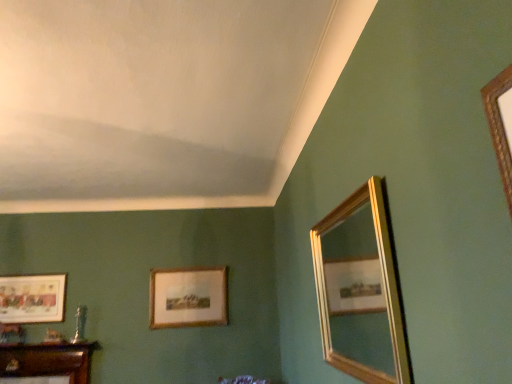
In order to face gold-framed picture at center, acting as the first picture frame starting from the right, should I rotate leftwards or rightwards?

Turn left by 8.998 degrees to look at gold-framed picture at center, acting as the first picture frame starting from the right.

This screenshot has height=384, width=512. What do you see at coordinates (188, 297) in the screenshot?
I see `gold-framed picture at center, which appears as the second picture frame when viewed from the left` at bounding box center [188, 297].

The width and height of the screenshot is (512, 384). Describe the element at coordinates (361, 289) in the screenshot. I see `gold-framed mirror at right` at that location.

Where is `gold-framed picture at center, acting as the first picture frame starting from the right`? gold-framed picture at center, acting as the first picture frame starting from the right is located at coordinates (188, 297).

Is gold-framed mirror at right completely or partially inside gold-framed picture at center, which appears as the second picture frame when viewed from the left?

No, gold-framed mirror at right is located outside of gold-framed picture at center, which appears as the second picture frame when viewed from the left.

Could you tell me if gold-framed picture at center, acting as the first picture frame starting from the right, is facing gold-framed mirror at right?

Yes, gold-framed picture at center, acting as the first picture frame starting from the right, is oriented towards gold-framed mirror at right.

Is gold-framed picture at center, acting as the first picture frame starting from the right, in front of or behind gold-framed mirror at right in the image?

gold-framed picture at center, acting as the first picture frame starting from the right, is positioned farther from the viewer than gold-framed mirror at right.

Does gold-framed picture at center, which appears as the second picture frame when viewed from the left, have a lesser width compared to gold-framed mirror at right?

Correct, the width of gold-framed picture at center, which appears as the second picture frame when viewed from the left, is less than that of gold-framed mirror at right.

In the image, is matte gold picture frame at lower left, arranged as the second picture frame when viewed from the right, positioned in front of or behind gold-framed mirror at right?

matte gold picture frame at lower left, arranged as the second picture frame when viewed from the right, is behind gold-framed mirror at right.

From the image's perspective, which one is positioned lower, matte gold picture frame at lower left, arranged as the first picture frame when viewed from the left, or gold-framed mirror at right?

matte gold picture frame at lower left, arranged as the first picture frame when viewed from the left, is shown below in the image.

Is matte gold picture frame at lower left, arranged as the first picture frame when viewed from the left, placed right next to gold-framed mirror at right?

No, matte gold picture frame at lower left, arranged as the first picture frame when viewed from the left, is not beside gold-framed mirror at right.

From a real-world perspective, is gold-framed mirror at right positioned over matte gold picture frame at lower left, arranged as the second picture frame when viewed from the right, based on gravity?

No, from a real-world perspective, gold-framed mirror at right is not above matte gold picture frame at lower left, arranged as the second picture frame when viewed from the right.

How different are the orientations of gold-framed mirror at right and matte gold picture frame at lower left, arranged as the first picture frame when viewed from the left, in degrees?

There is a 90-degree angle between the facing directions of gold-framed mirror at right and matte gold picture frame at lower left, arranged as the first picture frame when viewed from the left.

Is gold-framed mirror at right touching matte gold picture frame at lower left, arranged as the second picture frame when viewed from the right?

There is a gap between gold-framed mirror at right and matte gold picture frame at lower left, arranged as the second picture frame when viewed from the right.

Considering the sizes of objects gold-framed mirror at right and matte gold picture frame at lower left, arranged as the first picture frame when viewed from the left, in the image provided, who is taller, gold-framed mirror at right or matte gold picture frame at lower left, arranged as the first picture frame when viewed from the left,?

gold-framed mirror at right.

You are a GUI agent. You are given a task and a screenshot of the screen. Output one action in this format:
    pyautogui.click(x=<x>, y=<y>)
    Task: Click on the picture frame below the matte gold picture frame at lower left, arranged as the first picture frame when viewed from the left (from the image's perspective)
    The height and width of the screenshot is (384, 512).
    Given the screenshot: What is the action you would take?
    pyautogui.click(x=188, y=297)

From the image's perspective, does gold-framed picture at center, which appears as the second picture frame when viewed from the left, appear higher than matte gold picture frame at lower left, arranged as the second picture frame when viewed from the right?

Actually, gold-framed picture at center, which appears as the second picture frame when viewed from the left, appears below matte gold picture frame at lower left, arranged as the second picture frame when viewed from the right, in the image.

Is matte gold picture frame at lower left, arranged as the first picture frame when viewed from the left, inside gold-framed picture at center, acting as the first picture frame starting from the right?

No, matte gold picture frame at lower left, arranged as the first picture frame when viewed from the left, is located outside of gold-framed picture at center, acting as the first picture frame starting from the right.

Would you say gold-framed picture at center, acting as the first picture frame starting from the right, is a long distance from matte gold picture frame at lower left, arranged as the second picture frame when viewed from the right?

gold-framed picture at center, acting as the first picture frame starting from the right, is positioned a significant distance from matte gold picture frame at lower left, arranged as the second picture frame when viewed from the right.

Is point (398, 377) closer or farther from the camera than point (205, 303)?

Clearly, point (398, 377) is closer to the camera than point (205, 303).

Can you confirm if gold-framed mirror at right is smaller than gold-framed picture at center, which appears as the second picture frame when viewed from the left?

Incorrect, gold-framed mirror at right is not smaller in size than gold-framed picture at center, which appears as the second picture frame when viewed from the left.

Does gold-framed mirror at right lie behind gold-framed picture at center, acting as the first picture frame starting from the right?

No, it is in front of gold-framed picture at center, acting as the first picture frame starting from the right.

From a real-world perspective, is gold-framed mirror at right positioned over gold-framed picture at center, acting as the first picture frame starting from the right, based on gravity?

No, from a real-world perspective, gold-framed mirror at right is not on top of gold-framed picture at center, acting as the first picture frame starting from the right.

Looking at this image, can you confirm if matte gold picture frame at lower left, arranged as the first picture frame when viewed from the left, is bigger than gold-framed picture at center, which appears as the second picture frame when viewed from the left?

No, matte gold picture frame at lower left, arranged as the first picture frame when viewed from the left, is not bigger than gold-framed picture at center, which appears as the second picture frame when viewed from the left.

Considering the sizes of objects matte gold picture frame at lower left, arranged as the second picture frame when viewed from the right, and gold-framed picture at center, acting as the first picture frame starting from the right, in the image provided, who is shorter, matte gold picture frame at lower left, arranged as the second picture frame when viewed from the right, or gold-framed picture at center, acting as the first picture frame starting from the right,?

With less height is matte gold picture frame at lower left, arranged as the second picture frame when viewed from the right.

Is point (32, 294) farther from viewer compared to point (203, 290)?

No, it is not.

From a real-world perspective, between matte gold picture frame at lower left, arranged as the first picture frame when viewed from the left, and gold-framed picture at center, acting as the first picture frame starting from the right, who is vertically higher?

matte gold picture frame at lower left, arranged as the first picture frame when viewed from the left, is physically above.

At what (x,y) coordinates should I click in order to perform the action: click on mirror located on the right of gold-framed picture at center, which appears as the second picture frame when viewed from the left. Please return your answer as a coordinate pair (x, y). Looking at the image, I should click on (361, 289).

Find the location of a particular element. picture frame that is the 1st one when counting downward from the gold-framed mirror at right (from the image's perspective) is located at coordinates (32, 298).

Looking at the image, which one is located further to gold-framed mirror at right, matte gold picture frame at lower left, arranged as the second picture frame when viewed from the right, or gold-framed picture at center, acting as the first picture frame starting from the right?

matte gold picture frame at lower left, arranged as the second picture frame when viewed from the right, is positioned further to the anchor gold-framed mirror at right.

Based on the photo, which object lies further to the anchor point matte gold picture frame at lower left, arranged as the second picture frame when viewed from the right, gold-framed picture at center, which appears as the second picture frame when viewed from the left, or gold-framed mirror at right?

The object further to matte gold picture frame at lower left, arranged as the second picture frame when viewed from the right, is gold-framed mirror at right.

From the picture: Estimate the real-world distances between objects in this image. Which object is further from gold-framed picture at center, acting as the first picture frame starting from the right, gold-framed mirror at right or matte gold picture frame at lower left, arranged as the first picture frame when viewed from the left?

gold-framed mirror at right is positioned further to the anchor gold-framed picture at center, acting as the first picture frame starting from the right.

Considering their positions, is gold-framed picture at center, acting as the first picture frame starting from the right, positioned closer to gold-framed mirror at right than matte gold picture frame at lower left, arranged as the first picture frame when viewed from the left?

The object closer to gold-framed mirror at right is gold-framed picture at center, acting as the first picture frame starting from the right.

Based on their spatial positions, is gold-framed mirror at right or gold-framed picture at center, acting as the first picture frame starting from the right, further from matte gold picture frame at lower left, arranged as the second picture frame when viewed from the right?

gold-framed mirror at right lies further to matte gold picture frame at lower left, arranged as the second picture frame when viewed from the right, than the other object.

Which object lies nearer to the anchor point gold-framed picture at center, which appears as the second picture frame when viewed from the left, matte gold picture frame at lower left, arranged as the second picture frame when viewed from the right, or gold-framed mirror at right?

Based on the image, matte gold picture frame at lower left, arranged as the second picture frame when viewed from the right, appears to be nearer to gold-framed picture at center, which appears as the second picture frame when viewed from the left.

Identify the location of picture frame between gold-framed mirror at right and gold-framed picture at center, which appears as the second picture frame when viewed from the left, from front to back. The width and height of the screenshot is (512, 384). (32, 298).